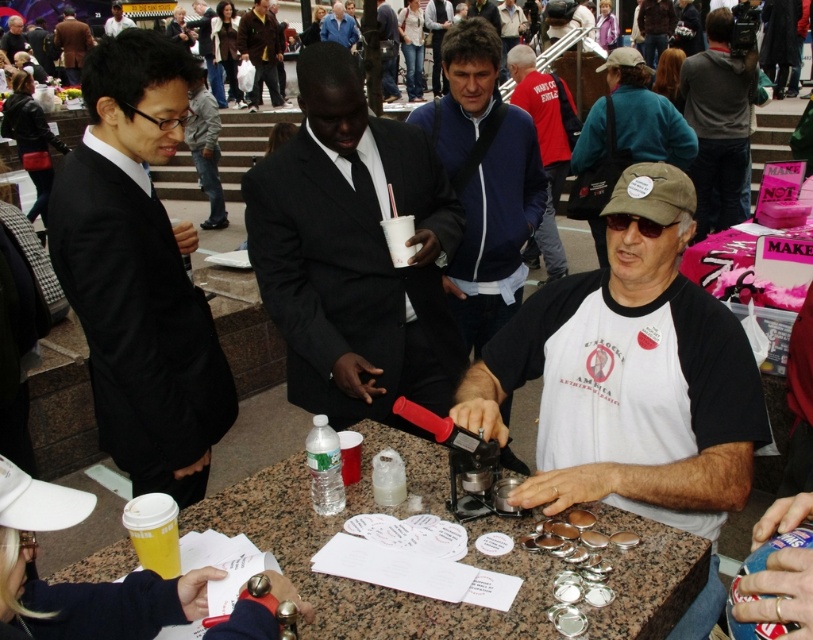
Question: Can you confirm if granite table at center is smaller than brown leather jacket at upper left?

Choices:
 (A) yes
 (B) no

Answer: (A)

Question: Is white cotton t-shirt at center positioned at the back of granite table at center?

Choices:
 (A) no
 (B) yes

Answer: (B)

Question: Which object is closer to the camera taking this photo?

Choices:
 (A) dark gray suit at upper center
 (B) black suit at center
 (C) matte black suit at left

Answer: (C)

Question: Which object is positioned closest to the brown leather jacket at upper left?

Choices:
 (A) black suit at center
 (B) gray hoodie at upper right
 (C) blue fabric jacket at center
 (D) dark gray suit at upper center

Answer: (D)

Question: Where is black suit at center located in relation to blue fabric jacket at center in the image?

Choices:
 (A) right
 (B) left

Answer: (B)

Question: Among these objects, which one is farthest from the camera?

Choices:
 (A) brown leather jacket at upper left
 (B) gray hoodie at upper right

Answer: (A)